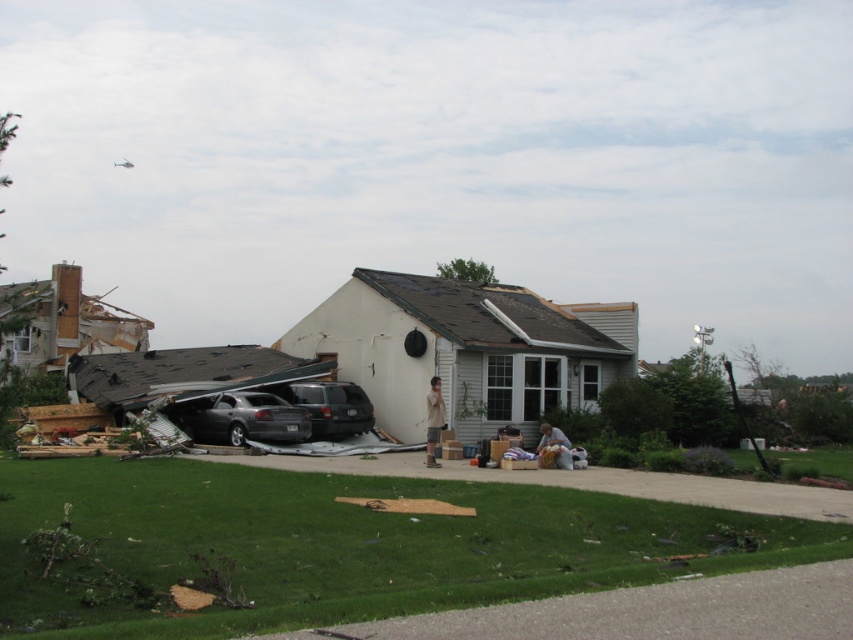
Does satin silver suv at center appear on the right side of brown cotton shirt at center?

Incorrect, satin silver suv at center is not on the right side of brown cotton shirt at center.

Between satin silver suv at center and brown cotton shirt at center, which one has less height?

brown cotton shirt at center is shorter.

Does point (364, 404) come in front of point (427, 436)?

No, (364, 404) is behind (427, 436).

The image size is (853, 640). I want to click on satin silver suv at center, so click(332, 406).

Is dark gray metallic car at center to the left of brown cotton shirt at center from the viewer's perspective?

Correct, you'll find dark gray metallic car at center to the left of brown cotton shirt at center.

Is dark gray metallic car at center bigger than brown cotton shirt at center?

Yes.

Between point (213, 426) and point (437, 388), which one is positioned in front?

Point (437, 388)

Identify the location of dark gray metallic car at center. This screenshot has height=640, width=853. (242, 419).

Locate an element on the screen. The width and height of the screenshot is (853, 640). dark gray metallic car at center is located at coordinates (242, 419).

This screenshot has width=853, height=640. Describe the element at coordinates (242, 419) in the screenshot. I see `dark gray metallic car at center` at that location.

The height and width of the screenshot is (640, 853). Find the location of `dark gray metallic car at center`. dark gray metallic car at center is located at coordinates (242, 419).